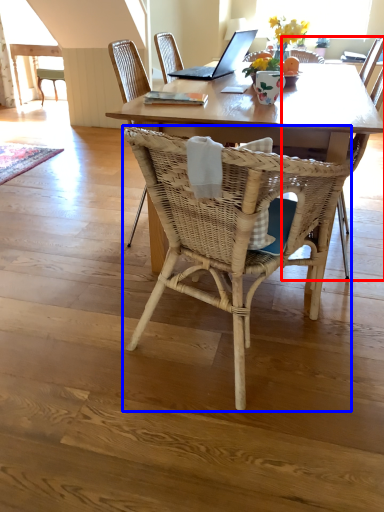
Question: Which point is further to the camera, armchair (highlighted by a red box) or chair (highlighted by a blue box)?

Choices:
 (A) armchair
 (B) chair

Answer: (A)